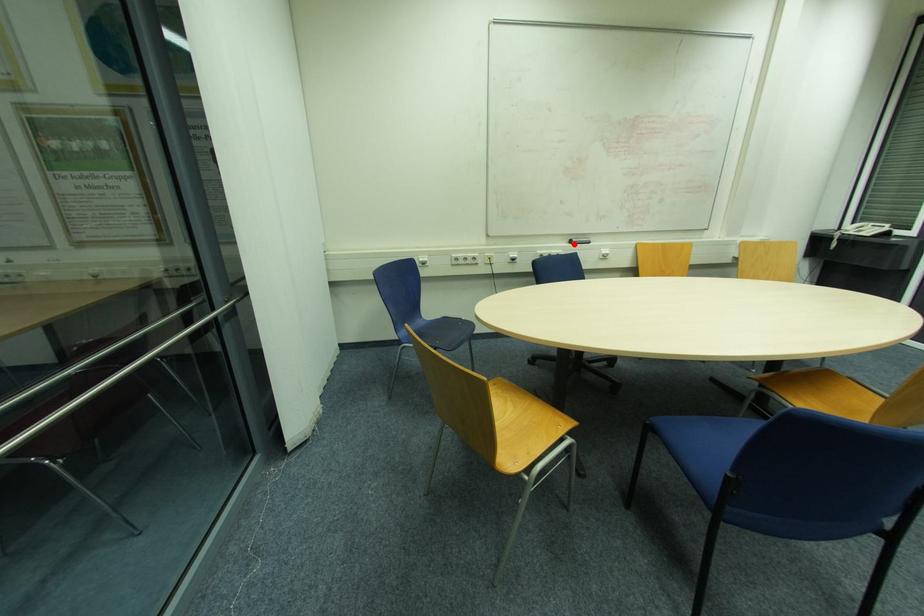
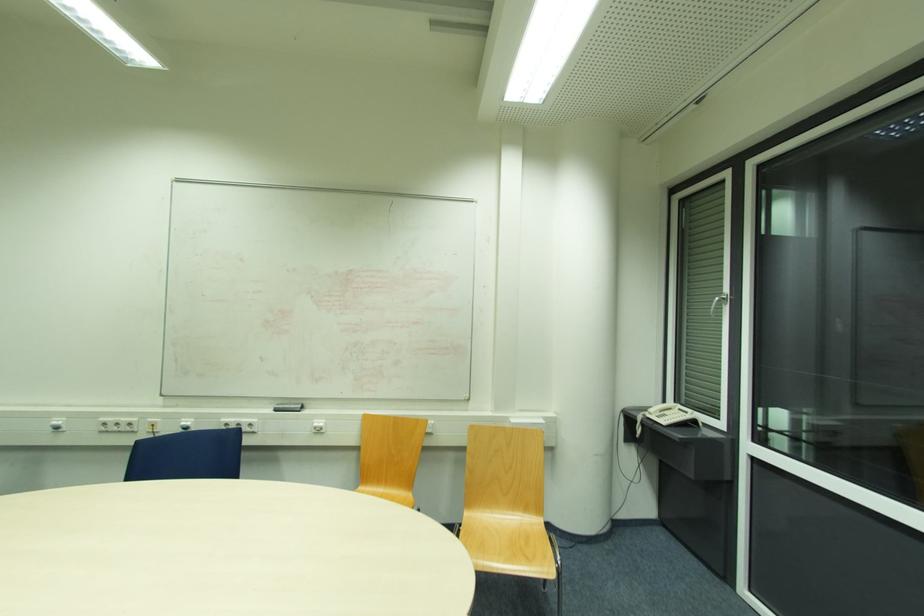
Question: I am providing you with two images of the same scene from different viewpoints. Given a red point in image1, look at the same physical point in image2. Is it:

Choices:
 (A) Closer to the viewpoint
 (B) Farther from the viewpoint

Answer: (B)